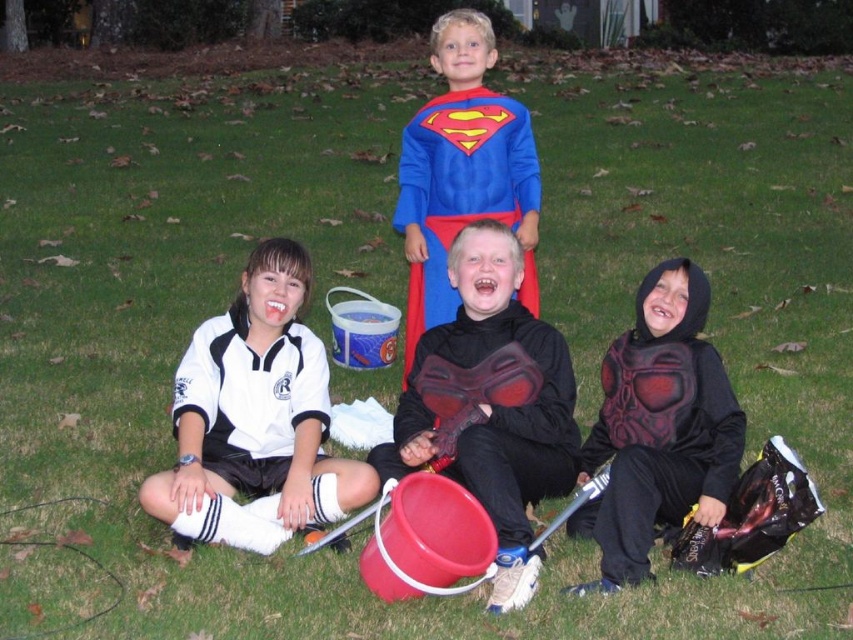
Question: Does rubberized black shield at center have a smaller size compared to black matte costume at lower right?

Choices:
 (A) yes
 (B) no

Answer: (B)

Question: Estimate the real-world distances between objects in this image. Which object is closer to the superman costume at center?

Choices:
 (A) white jersey at center
 (B) black matte costume at lower right
 (C) rubberized black shield at center

Answer: (C)

Question: Which point appears closest to the camera in this image?

Choices:
 (A) [408, 387]
 (B) [294, 529]
 (C) [705, 342]

Answer: (B)

Question: Among these points, which one is nearest to the camera?

Choices:
 (A) (289, 404)
 (B) (502, 592)

Answer: (B)

Question: Can you confirm if white jersey at center is positioned above black matte costume at lower right?

Choices:
 (A) no
 (B) yes

Answer: (B)

Question: Does rubberized black shield at center appear on the left side of superman costume at center?

Choices:
 (A) no
 (B) yes

Answer: (A)